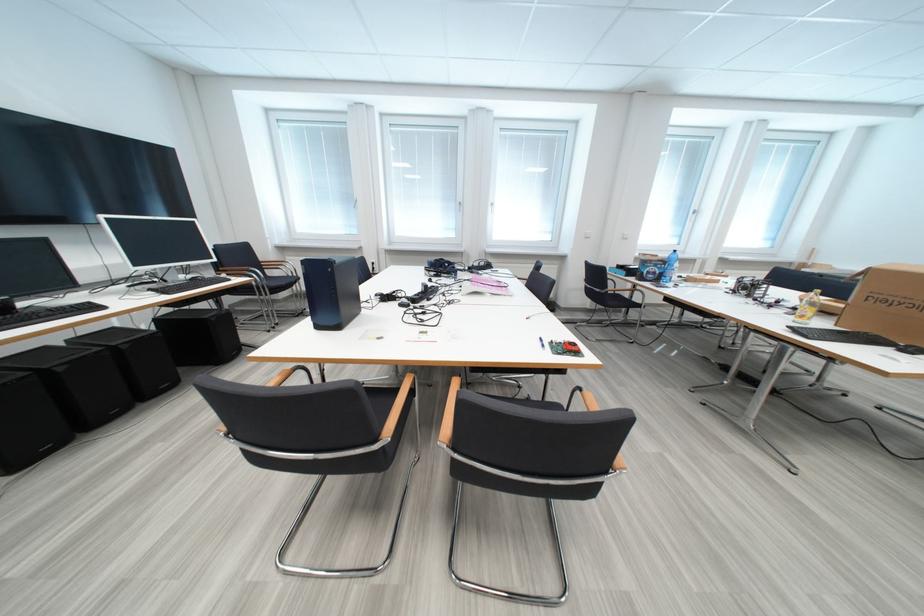
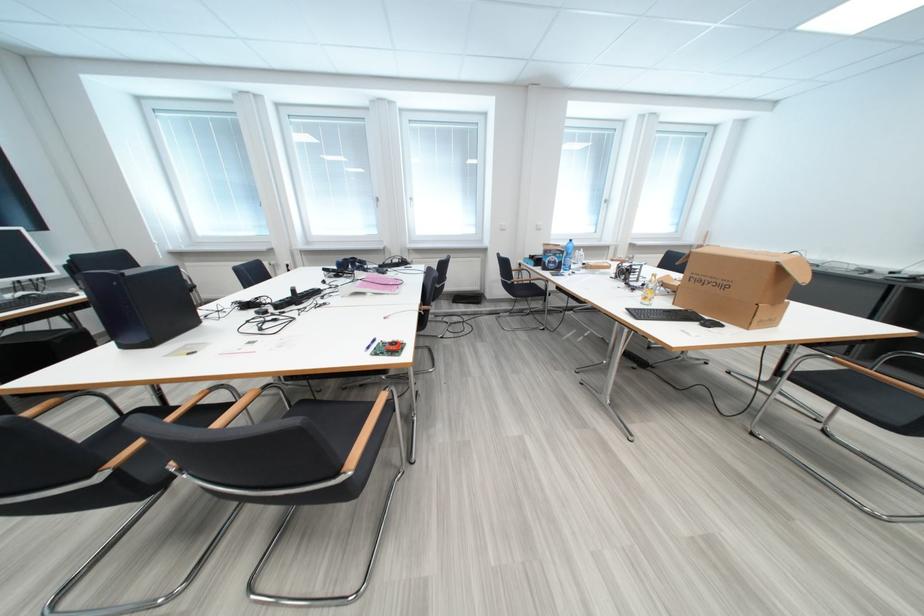
Locate, in the second image, the point that corresponds to the point at 813,262 in the first image.

(711, 245)